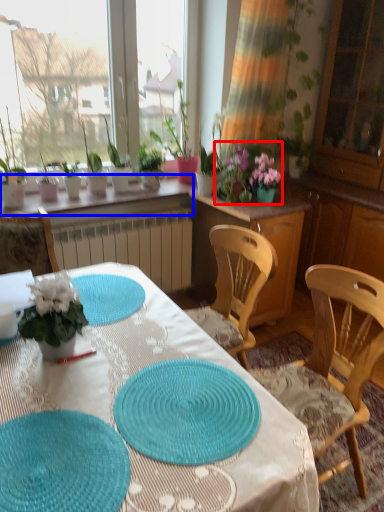
Question: Which of the following is the closest to the observer, floral arrangement (highlighted by a red box) or window sill (highlighted by a blue box)?

Choices:
 (A) floral arrangement
 (B) window sill

Answer: (B)